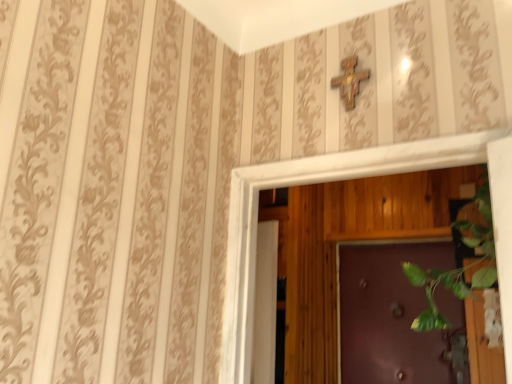
Question: Is the depth of purple glossy door at center greater than that of wooden cross at upper center?

Choices:
 (A) yes
 (B) no

Answer: (A)

Question: From the image's perspective, is purple glossy door at center below wooden cross at upper center?

Choices:
 (A) yes
 (B) no

Answer: (A)

Question: Considering the relative sizes of purple glossy door at center and wooden cross at upper center in the image provided, is purple glossy door at center thinner than wooden cross at upper center?

Choices:
 (A) no
 (B) yes

Answer: (A)

Question: Is purple glossy door at center positioned beyond the bounds of wooden cross at upper center?

Choices:
 (A) no
 (B) yes

Answer: (B)

Question: Does purple glossy door at center turn towards wooden cross at upper center?

Choices:
 (A) yes
 (B) no

Answer: (A)

Question: From a real-world perspective, does purple glossy door at center sit lower than wooden cross at upper center?

Choices:
 (A) yes
 (B) no

Answer: (A)

Question: Is wooden cross at upper center at the left side of purple glossy door at center?

Choices:
 (A) no
 (B) yes

Answer: (B)

Question: Would you say wooden cross at upper center is a long distance from purple glossy door at center?

Choices:
 (A) no
 (B) yes

Answer: (B)

Question: From the image's perspective, is wooden cross at upper center under purple glossy door at center?

Choices:
 (A) yes
 (B) no

Answer: (B)

Question: Is wooden cross at upper center oriented away from purple glossy door at center?

Choices:
 (A) yes
 (B) no

Answer: (A)

Question: From a real-world perspective, is wooden cross at upper center positioned over purple glossy door at center based on gravity?

Choices:
 (A) no
 (B) yes

Answer: (B)

Question: Is wooden cross at upper center aimed at purple glossy door at center?

Choices:
 (A) yes
 (B) no

Answer: (B)

Question: Visually, is wooden cross at upper center positioned to the left or to the right of purple glossy door at center?

Choices:
 (A) right
 (B) left

Answer: (B)